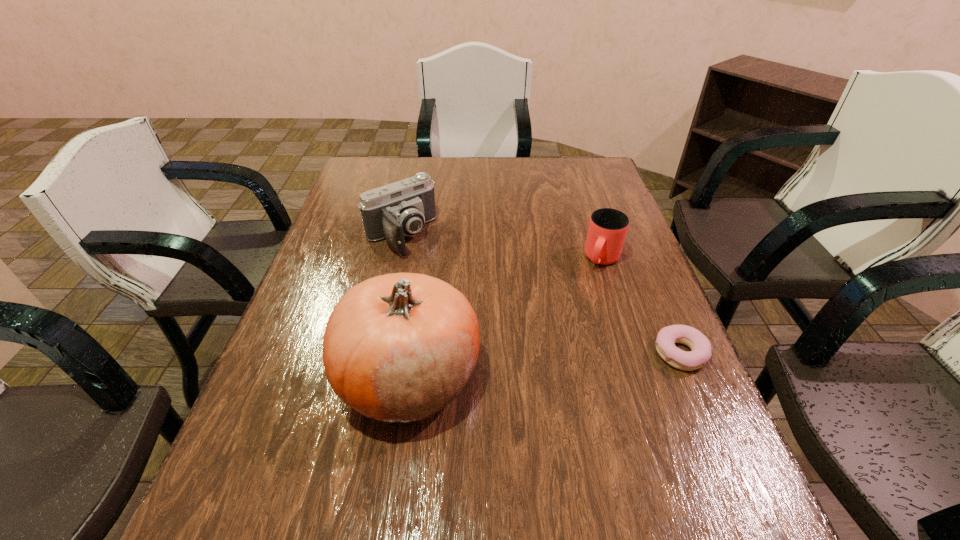
Where is `vacant area at the left edge`? Image resolution: width=960 pixels, height=540 pixels. vacant area at the left edge is located at coordinates (353, 246).

I want to click on vacant space at the right edge of the desktop, so click(649, 285).

The height and width of the screenshot is (540, 960). In the image, there is a desktop. Find the location of `vacant space at the far right corner`. vacant space at the far right corner is located at coordinates (598, 180).

Find the location of a particular element. Image resolution: width=960 pixels, height=540 pixels. free space at the near right corner of the desktop is located at coordinates (674, 460).

Where is `free space between the doughnut and the third shortest object`? This screenshot has width=960, height=540. free space between the doughnut and the third shortest object is located at coordinates (540, 294).

Find the location of a particular element. This screenshot has width=960, height=540. vacant space that is in between the cup and the tallest object is located at coordinates (506, 318).

Identify the location of unoccupied area between the second shortest object and the shortest object. This screenshot has height=540, width=960. (641, 306).

Find the location of a particular element. vacant area that lies between the doughnut and the camera is located at coordinates (540, 294).

Where is `vacant point located between the camera and the shortest object`? vacant point located between the camera and the shortest object is located at coordinates (540, 294).

Locate an element on the screen. This screenshot has width=960, height=540. free point between the shortest object and the cup is located at coordinates (641, 306).